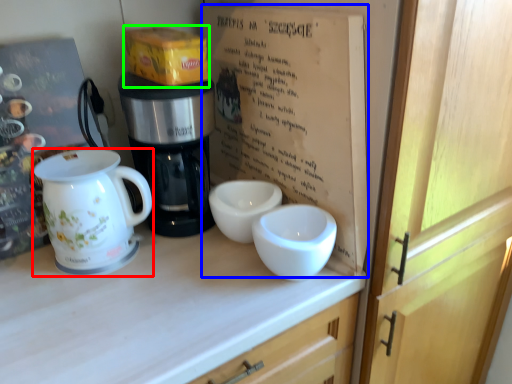
Question: Which object is positioned farthest from jug (highlighted by a red box)? Select from book (highlighted by a blue box) and cardboard box (highlighted by a green box).

Choices:
 (A) book
 (B) cardboard box

Answer: (A)